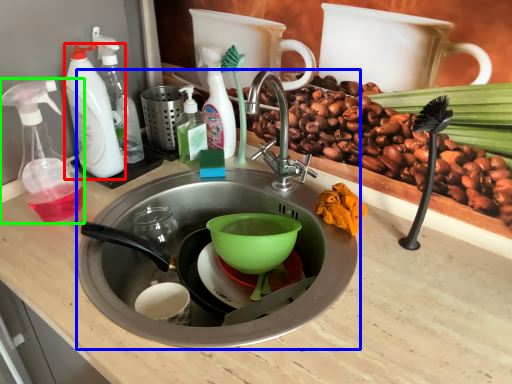
Question: Which object is positioned farthest from cleaning product (highlighted by a red box)? Select from sink (highlighted by a blue box) and soap dispenser (highlighted by a green box).

Choices:
 (A) sink
 (B) soap dispenser

Answer: (A)